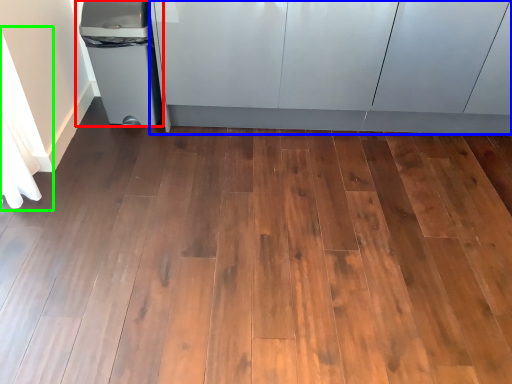
Question: Which object is the farthest from waste container (highlighted by a red box)? Choose among these: cabinetry (highlighted by a blue box) or curtain (highlighted by a green box).

Choices:
 (A) cabinetry
 (B) curtain

Answer: (A)